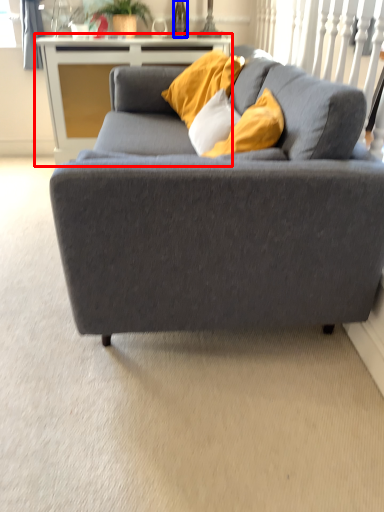
Question: Among these objects, which one is farthest to the camera, table (highlighted by a red box) or wine bottle (highlighted by a blue box)?

Choices:
 (A) table
 (B) wine bottle

Answer: (B)